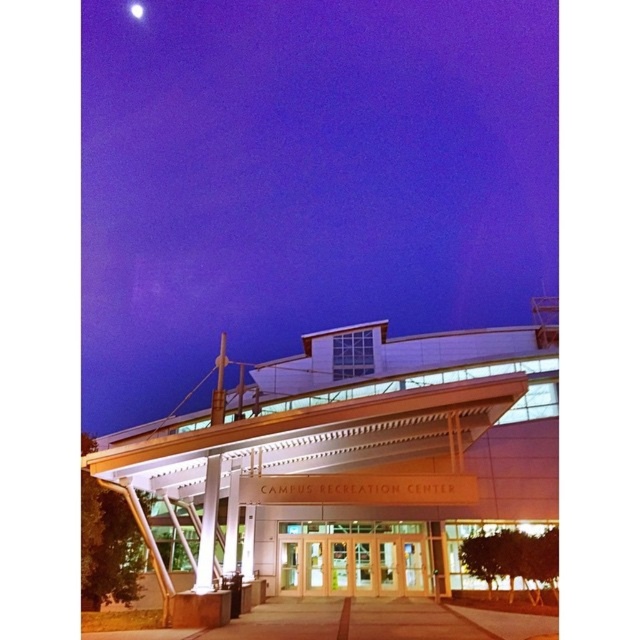
You are a visitor approaching the Campus Recreation Center and want to enter through the clear glass doors at center. As you walk towards the doors, will the bright white sphere at upper center become more visible or less visible?

The clear glass doors at center are in front of the bright white sphere at upper center, so as you approach the doors, the bright white sphere at upper center will become less visible because it is behind the doors.

You are standing at the entrance of the Campus Recreation Center and want to locate two specific points marked on the building facade. The first point is at coordinate point (x=412, y=529) and the second is at point (x=129, y=10). Which of these two points is nearer to your current position?

Point (x=412, y=529) is closer to the viewer than point (x=129, y=10).

You are a visitor approaching the Campus Recreation Center entrance. You see the clear glass doors at center and the white glossy pillar at center. Which object is positioned to the right of the other?

The clear glass doors at center are to the right of the white glossy pillar at center.